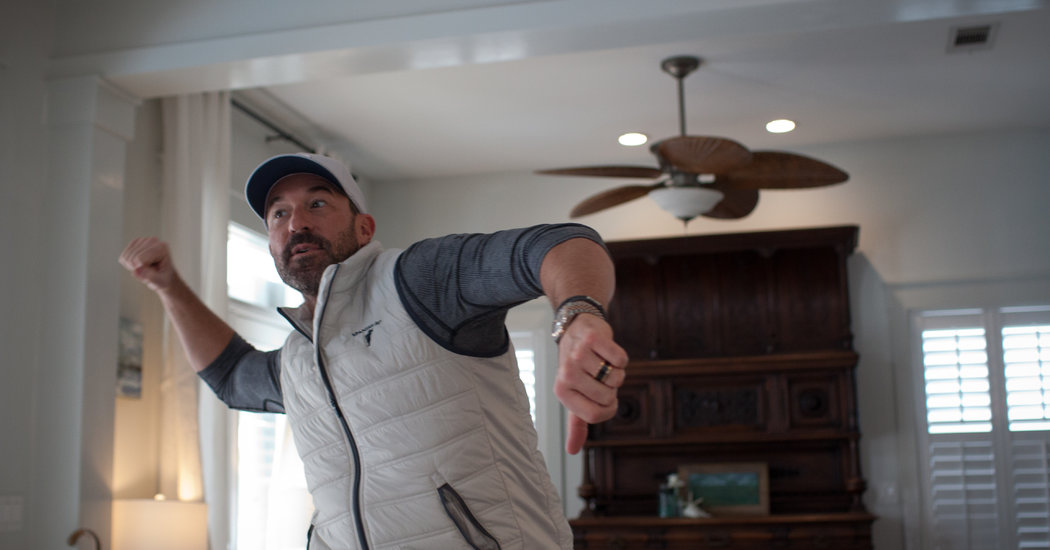
Locate an element on the screen. This screenshot has height=550, width=1050. tall brown wooden cabinet is located at coordinates (700, 314).